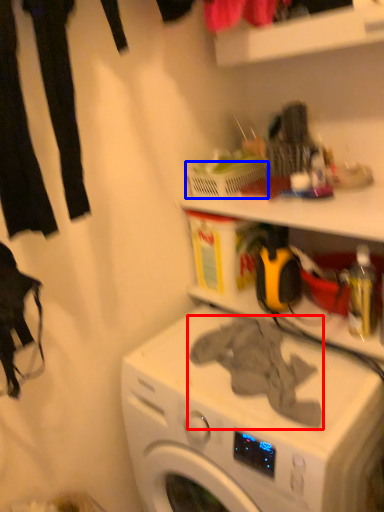
Question: Which point is closer to the camera, clothing (highlighted by a red box) or basket (highlighted by a blue box)?

Choices:
 (A) clothing
 (B) basket

Answer: (A)